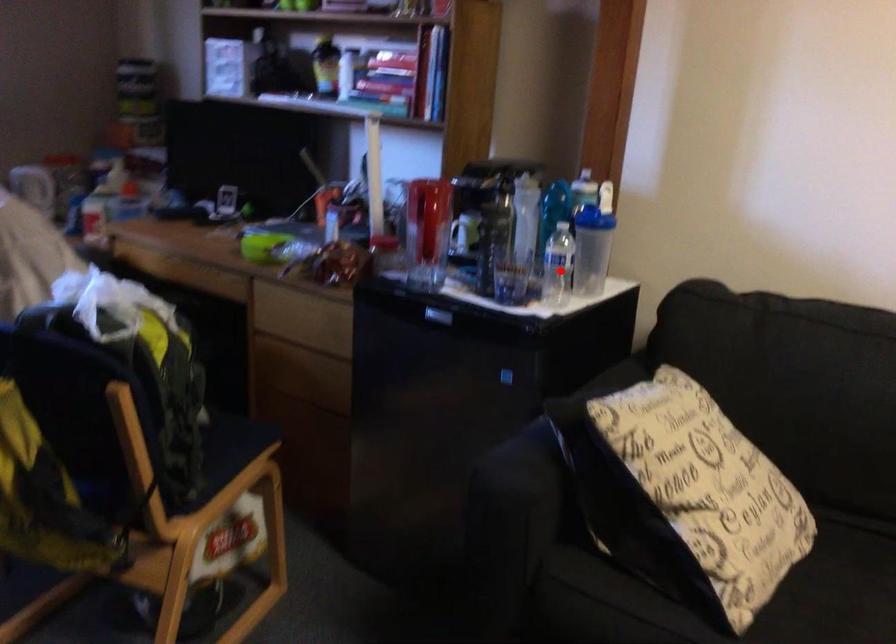
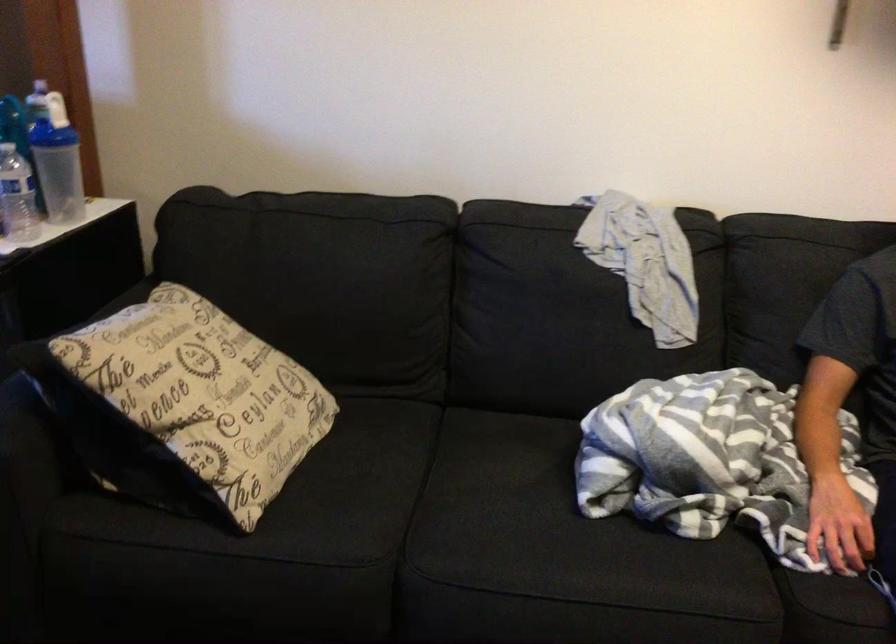
In the second image, find the point that corresponds to the highlighted location in the first image.

(16, 196)